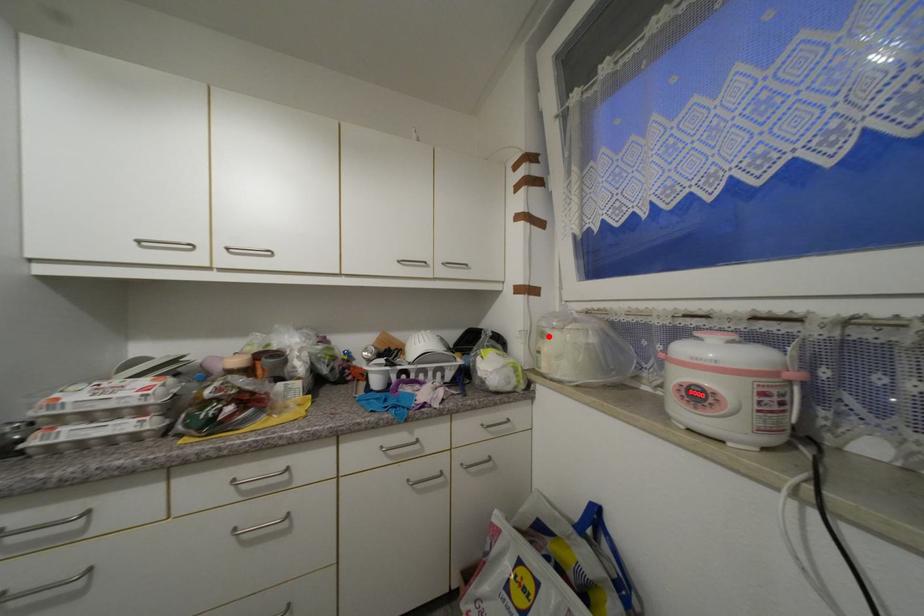
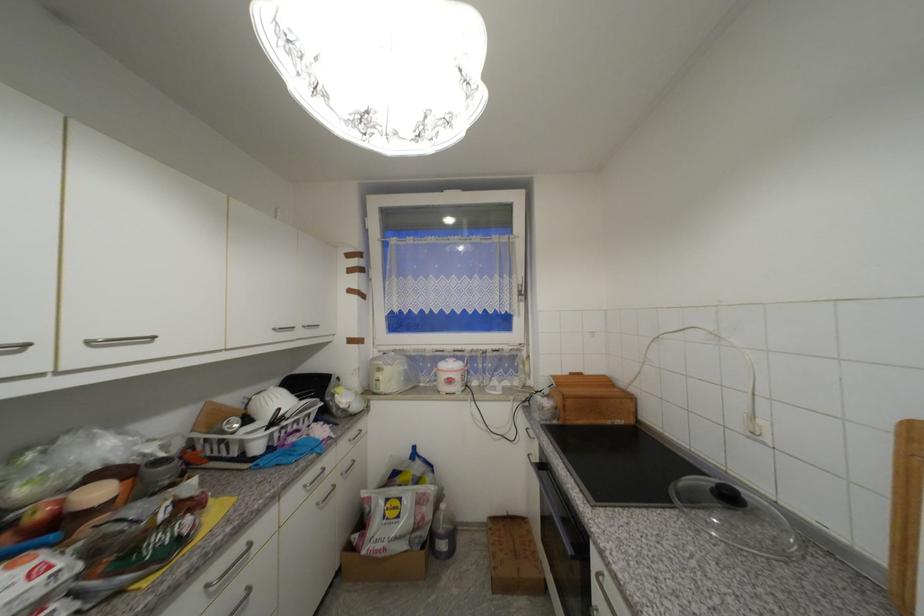
Find the pixel in the second image that matches the highlighted location in the first image.

(385, 371)